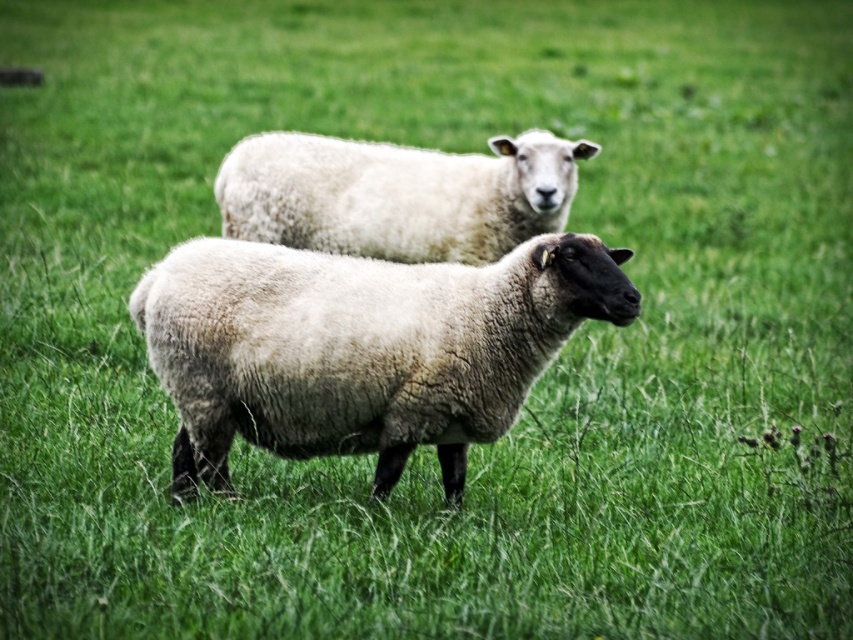
You are a farmer checking the sheep in the field. You need to approach the white woolen sheep at center and the white woolly sheep at upper center. Which sheep should you approach first to reach the one behind it?

You should approach the white woolly sheep at upper center first because the white woolen sheep at center is in front of it, so you need to go around or move the white woolen sheep at center to access the one behind.

You are a farmer checking the size of your sheep. You have a fence gate that is 1.2 meters wide. Can both the white woolen sheep at center and the white woolly sheep at upper center pass through the gate when entering one at a time?

The white woolen sheep at center is narrower than the white woolly sheep at upper center. Since the gate is 1.2 meters wide, the white woolen sheep at center can pass through easily. However, the white woolly sheep at upper center is wider and might not fit through the gate. Therefore, only the white woolen sheep at center can pass through the gate.